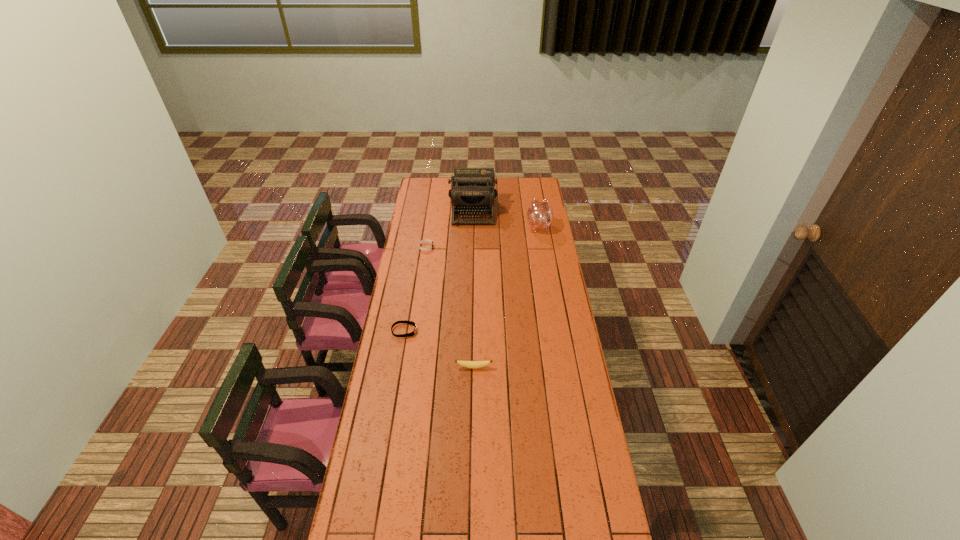
This screenshot has width=960, height=540. Identify the location of the tallest object. (472, 192).

Find the location of a particular element. This screenshot has width=960, height=540. the rightmost object is located at coordinates (540, 215).

I want to click on the fourth shortest object, so click(540, 215).

Identify the location of the nearest object. This screenshot has height=540, width=960. (468, 364).

Find the location of a particular element. Image resolution: width=960 pixels, height=540 pixels. banana is located at coordinates (468, 364).

Where is `the taller wristband`? the taller wristband is located at coordinates (425, 240).

Where is `the fourth tallest object`? Image resolution: width=960 pixels, height=540 pixels. the fourth tallest object is located at coordinates (425, 240).

I want to click on the fourth farthest object, so click(404, 321).

Identify the location of the shorter wristband. The height and width of the screenshot is (540, 960). (404, 321).

Where is `vacant area situated on the keyboard of the typewriter`? vacant area situated on the keyboard of the typewriter is located at coordinates coord(472,257).